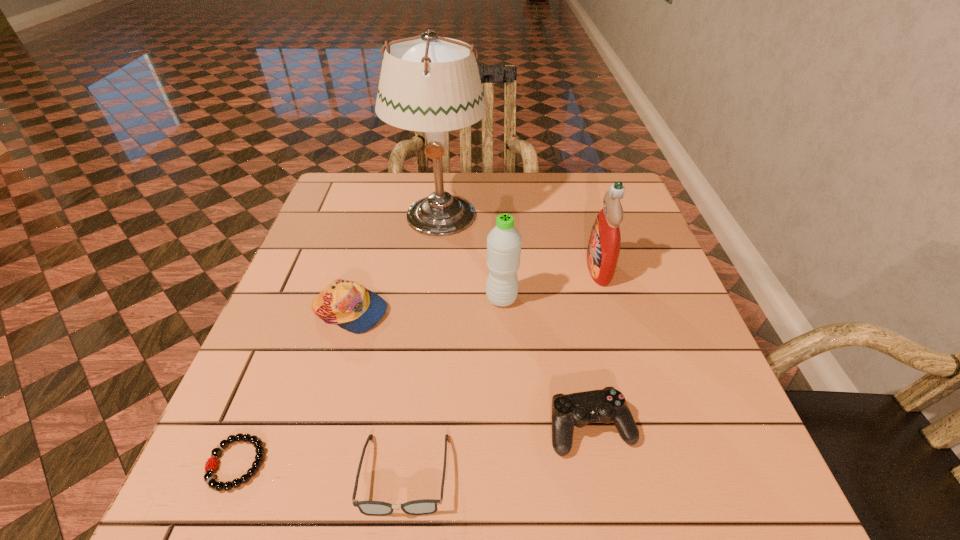
Locate an element on the screen. This screenshot has width=960, height=540. vacant space situated on the front surface of the detergent is located at coordinates (557, 269).

Find the location of a particular element. The width and height of the screenshot is (960, 540). vacant space located 0.070m on the front surface of the detergent is located at coordinates (557, 269).

Where is `vacant position located on the front of the water bottle`? The height and width of the screenshot is (540, 960). vacant position located on the front of the water bottle is located at coordinates (511, 477).

Identify the location of free space located on the bill of the cap. The image size is (960, 540). (535, 312).

In order to click on vacant space located on the back of the control in this screenshot , I will do `click(574, 343)`.

This screenshot has width=960, height=540. What are the coordinates of `free space located on the back of the shortest object` in the screenshot? It's located at (287, 339).

What are the coordinates of `object that is at the far edge` in the screenshot? It's located at (431, 84).

The width and height of the screenshot is (960, 540). Identify the location of spectacles at the near edge. (425, 506).

This screenshot has width=960, height=540. Identify the location of bracelet located in the near edge section of the desktop. (209, 478).

Where is `cap that is positioned at the left edge`? cap that is positioned at the left edge is located at coordinates (351, 306).